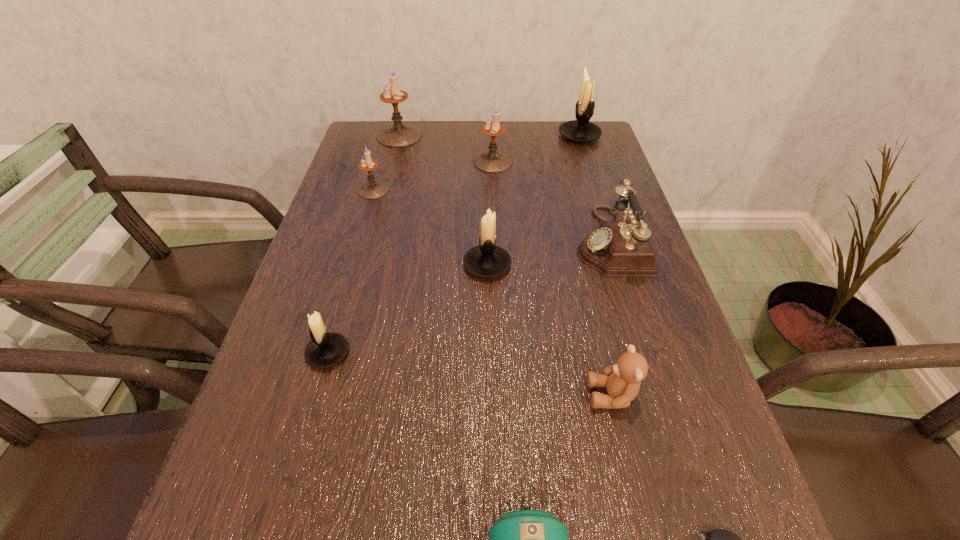
Where is `the biggest purple candle holder`? This screenshot has width=960, height=540. the biggest purple candle holder is located at coordinates (398, 134).

Identify the location of the rightmost candle holder. This screenshot has width=960, height=540. (581, 130).

Image resolution: width=960 pixels, height=540 pixels. I want to click on the biggest white candle holder, so (x=581, y=130).

At what (x,y) coordinates should I click in order to perform the action: click on the eighth nearest object. Please return your answer as a coordinate pair (x, y). Looking at the image, I should click on (492, 161).

Image resolution: width=960 pixels, height=540 pixels. Identify the location of the rightmost purple candle holder. (492, 161).

Locate an element on the screen. The width and height of the screenshot is (960, 540). the second smallest white candle holder is located at coordinates (486, 260).

This screenshot has height=540, width=960. I want to click on the second nearest candle holder, so click(x=486, y=260).

The image size is (960, 540). What are the coordinates of `telephone` in the screenshot? It's located at (617, 248).

Image resolution: width=960 pixels, height=540 pixels. What are the coordinates of `the seventh nearest object` in the screenshot? It's located at (372, 189).

Locate an element on the screen. The width and height of the screenshot is (960, 540). the fourth farthest candle holder is located at coordinates (372, 189).